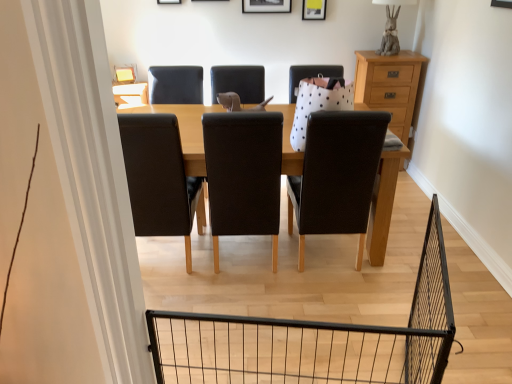
Question: Does black matte picture frame at upper center, positioned as the 1th picture frame in left-to-right order, lie behind light brown wooden chest of drawers at right?

Choices:
 (A) no
 (B) yes

Answer: (B)

Question: From the image's perspective, is black matte picture frame at upper center, which is the second picture frame in right-to-left order, over light brown wooden chest of drawers at right?

Choices:
 (A) no
 (B) yes

Answer: (B)

Question: Is black matte picture frame at upper center, which is the second picture frame in right-to-left order, far from light brown wooden chest of drawers at right?

Choices:
 (A) yes
 (B) no

Answer: (A)

Question: Is black matte picture frame at upper center, positioned as the 1th picture frame in left-to-right order, thinner than light brown wooden chest of drawers at right?

Choices:
 (A) yes
 (B) no

Answer: (A)

Question: Does black matte picture frame at upper center, positioned as the 1th picture frame in left-to-right order, appear on the right side of light brown wooden chest of drawers at right?

Choices:
 (A) yes
 (B) no

Answer: (B)

Question: Is light brown wooden chest of drawers at right in front of or behind matte yellow picture frame at upper center, placed as the first picture frame when sorted from right to left, in the image?

Choices:
 (A) behind
 (B) front

Answer: (B)

Question: From a real-world perspective, is light brown wooden chest of drawers at right positioned above or below matte yellow picture frame at upper center, placed as the first picture frame when sorted from right to left?

Choices:
 (A) below
 (B) above

Answer: (A)

Question: Based on their sizes in the image, would you say light brown wooden chest of drawers at right is bigger or smaller than matte yellow picture frame at upper center, placed as the first picture frame when sorted from right to left?

Choices:
 (A) big
 (B) small

Answer: (A)

Question: Would you say light brown wooden chest of drawers at right is to the left or to the right of matte yellow picture frame at upper center, placed as the first picture frame when sorted from right to left, in the picture?

Choices:
 (A) right
 (B) left

Answer: (A)

Question: Considering the positions of matte yellow picture frame at upper center, placed as the first picture frame when sorted from right to left, and light brown wooden chest of drawers at right in the image, is matte yellow picture frame at upper center, placed as the first picture frame when sorted from right to left, wider or thinner than light brown wooden chest of drawers at right?

Choices:
 (A) wide
 (B) thin

Answer: (B)

Question: Looking at the image, does matte yellow picture frame at upper center, which ranks as the second picture frame in left-to-right order, seem bigger or smaller compared to light brown wooden chest of drawers at right?

Choices:
 (A) big
 (B) small

Answer: (B)

Question: In the image, is matte yellow picture frame at upper center, which ranks as the second picture frame in left-to-right order, on the left side or the right side of light brown wooden chest of drawers at right?

Choices:
 (A) left
 (B) right

Answer: (A)

Question: Considering the positions of matte yellow picture frame at upper center, which ranks as the second picture frame in left-to-right order, and light brown wooden chest of drawers at right in the image, is matte yellow picture frame at upper center, which ranks as the second picture frame in left-to-right order, taller or shorter than light brown wooden chest of drawers at right?

Choices:
 (A) short
 (B) tall

Answer: (A)

Question: In terms of height, does black matte picture frame at upper center, which is the second picture frame in right-to-left order, look taller or shorter compared to matte yellow picture frame at upper center, placed as the first picture frame when sorted from right to left?

Choices:
 (A) tall
 (B) short

Answer: (A)

Question: Is black matte picture frame at upper center, positioned as the 1th picture frame in left-to-right order, bigger or smaller than matte yellow picture frame at upper center, placed as the first picture frame when sorted from right to left?

Choices:
 (A) big
 (B) small

Answer: (A)